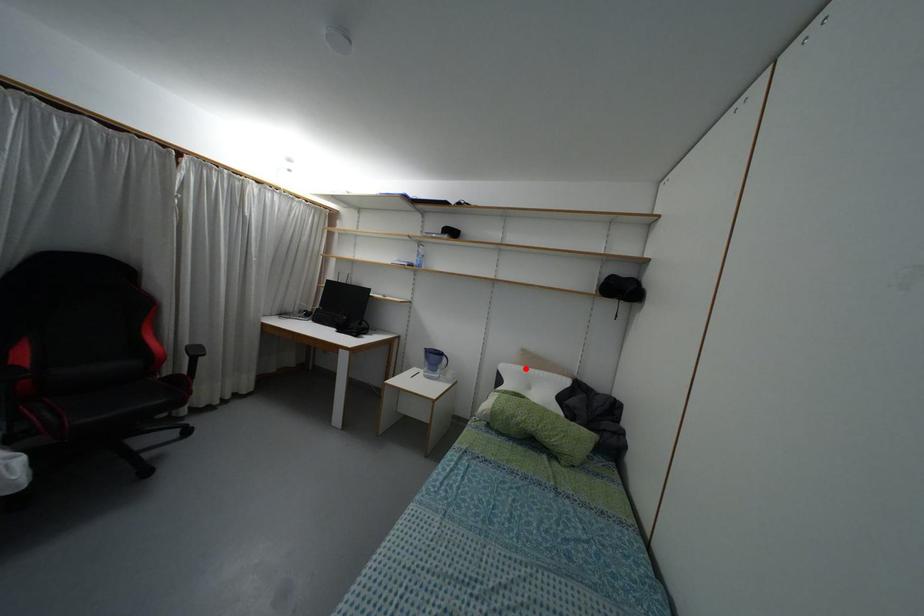
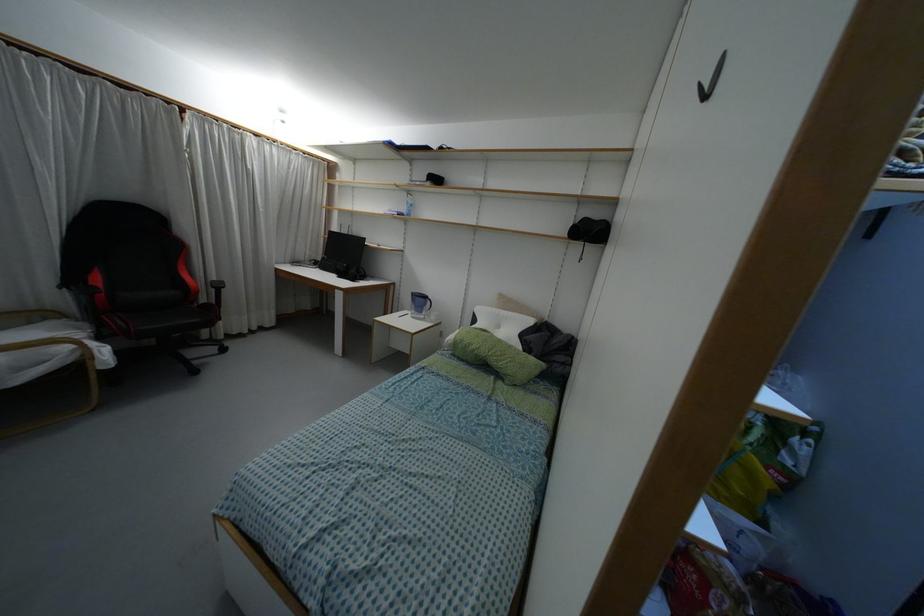
In the second image, find the point that corresponds to the highlighted location in the first image.

(496, 310)